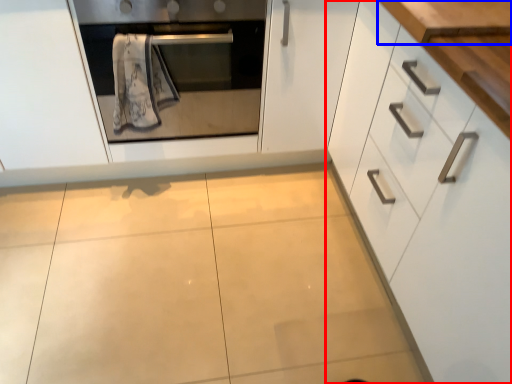
Question: Which of the following is the closest to the observer, cabinetry (highlighted by a red box) or counter top (highlighted by a blue box)?

Choices:
 (A) cabinetry
 (B) counter top

Answer: (A)